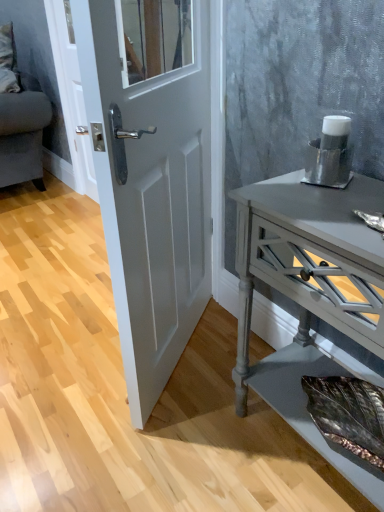
Question: From a real-world perspective, is white glossy door at center below velvet grey couch at upper left?

Choices:
 (A) yes
 (B) no

Answer: (A)

Question: Does white glossy door at center come behind velvet grey couch at upper left?

Choices:
 (A) yes
 (B) no

Answer: (B)

Question: Does white glossy door at center lie in front of velvet grey couch at upper left?

Choices:
 (A) yes
 (B) no

Answer: (A)

Question: Is velvet grey couch at upper left inside white glossy door at center?

Choices:
 (A) no
 (B) yes

Answer: (A)

Question: Is white glossy door at center oriented towards velvet grey couch at upper left?

Choices:
 (A) yes
 (B) no

Answer: (B)

Question: Which is correct: silver metallic cup at right is inside velvet grey couch at upper left, or outside of it?

Choices:
 (A) outside
 (B) inside

Answer: (A)

Question: In the image, is silver metallic cup at right positioned in front of or behind velvet grey couch at upper left?

Choices:
 (A) behind
 (B) front

Answer: (B)

Question: Considering the positions of silver metallic cup at right and velvet grey couch at upper left in the image, is silver metallic cup at right taller or shorter than velvet grey couch at upper left?

Choices:
 (A) tall
 (B) short

Answer: (B)

Question: From the image's perspective, is silver metallic cup at right located above or below velvet grey couch at upper left?

Choices:
 (A) below
 (B) above

Answer: (A)

Question: Do you think matte gray wooden nightstand at right is within silver metallic cup at right, or outside of it?

Choices:
 (A) outside
 (B) inside

Answer: (A)

Question: Relative to silver metallic cup at right, is matte gray wooden nightstand at right in front or behind?

Choices:
 (A) behind
 (B) front

Answer: (B)

Question: From a real-world perspective, is matte gray wooden nightstand at right above or below silver metallic cup at right?

Choices:
 (A) above
 (B) below

Answer: (B)

Question: Looking at their shapes, would you say matte gray wooden nightstand at right is wider or thinner than silver metallic cup at right?

Choices:
 (A) thin
 (B) wide

Answer: (B)

Question: From a real-world perspective, relative to silver metallic cup at right, is velvet grey couch at upper left vertically above or below?

Choices:
 (A) above
 (B) below

Answer: (A)

Question: Based on their positions, is velvet grey couch at upper left located to the left or right of silver metallic cup at right?

Choices:
 (A) right
 (B) left

Answer: (B)